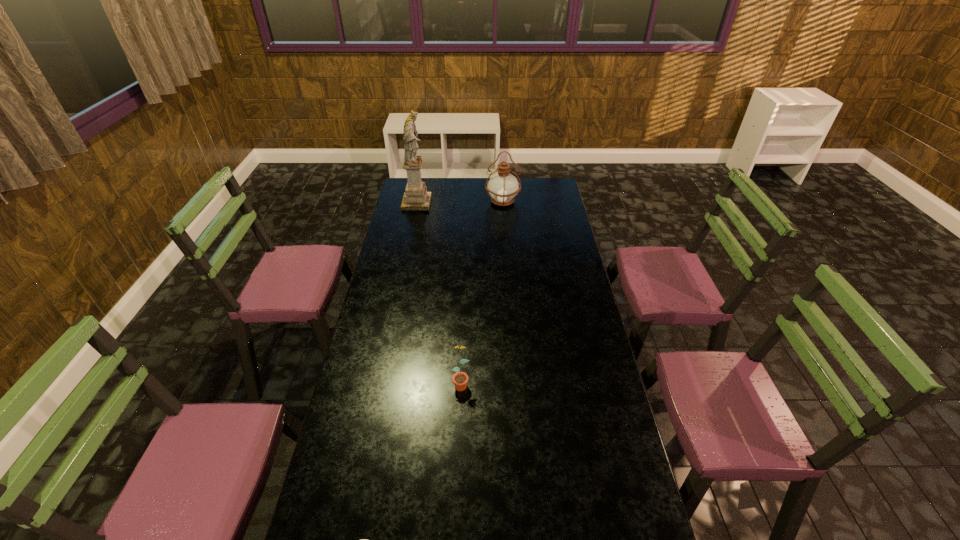
This screenshot has width=960, height=540. I want to click on unoccupied area between the rightmost object and the sculpture, so click(460, 202).

Locate an element on the screen. object that is the third closest one to the shortest object is located at coordinates (503, 187).

This screenshot has height=540, width=960. Find the location of `object that ranks as the second closest to the third shortest object`. object that ranks as the second closest to the third shortest object is located at coordinates (460, 379).

Image resolution: width=960 pixels, height=540 pixels. I want to click on free space that satisfies the following two spatial constraints: 1. on the front side of the third shortest object; 2. on the front-facing side of the tallest object, so click(x=503, y=203).